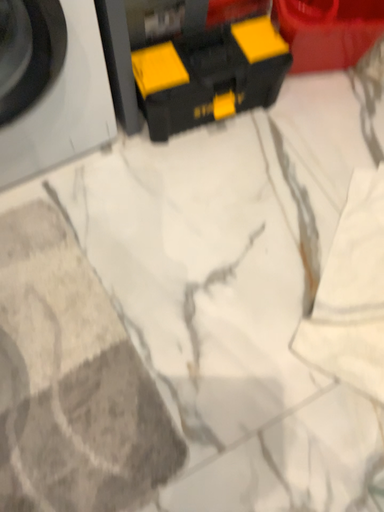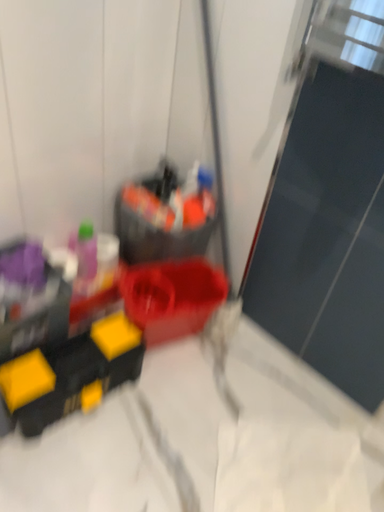
Question: How did the camera likely rotate when shooting the video?

Choices:
 (A) rotated downward
 (B) rotated upward

Answer: (B)